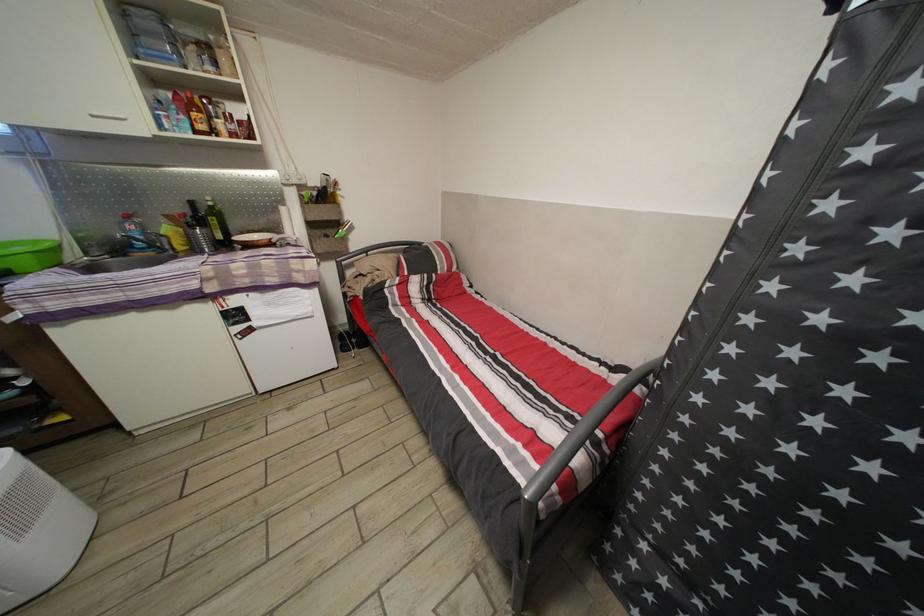
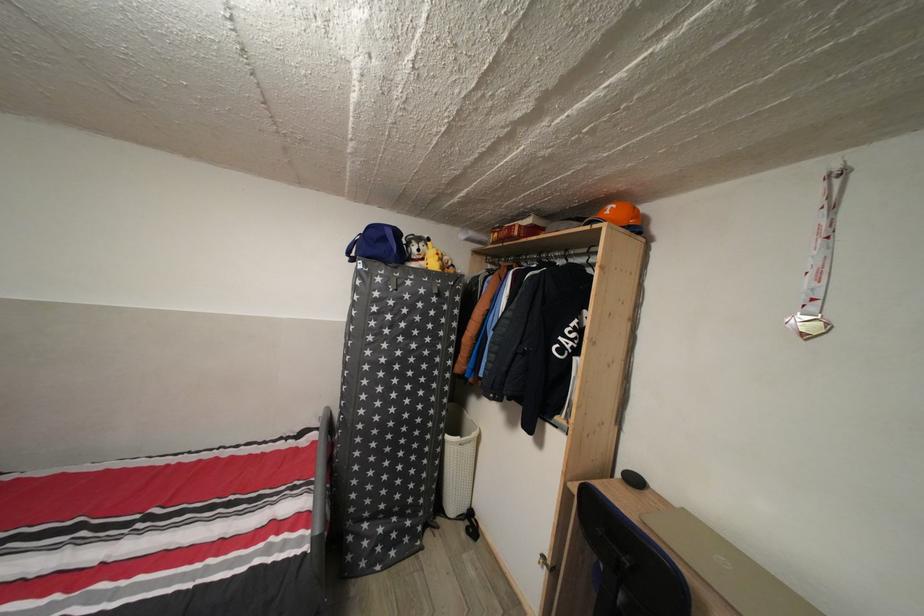
Locate, in the second image, the point that corresponds to [710,475] in the first image.

(380, 451)